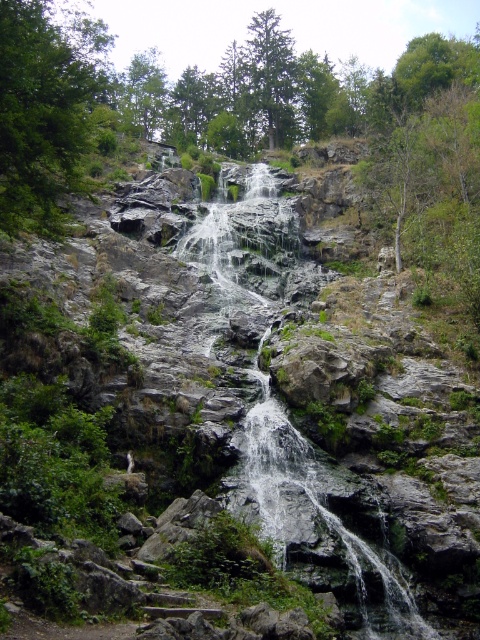
Does green leafy tree at upper left have a greater width compared to green leafy tree at upper center?

Yes, green leafy tree at upper left is wider than green leafy tree at upper center.

Does green leafy tree at upper left have a smaller size compared to green leafy tree at upper center?

Incorrect, green leafy tree at upper left is not smaller in size than green leafy tree at upper center.

Who is more distant from viewer, [31,177] or [148,54]?

The point [148,54] is behind.

At what (x,y) coordinates should I click in order to perform the action: click on green leafy tree at upper left. Please return your answer as a coordinate pair (x, y). This screenshot has height=640, width=480. Looking at the image, I should click on (45, 106).

Who is lower down, green leafy tree at upper left or green matte tree at upper center?

green leafy tree at upper left is below.

In order to click on green leafy tree at upper left in this screenshot , I will do `click(45, 106)`.

Who is higher up, gray stone waterfall at center or green matte tree at upper center?

green matte tree at upper center

Is point (186, 252) positioned after point (269, 58)?

That is False.

Locate an element on the screen. gray stone waterfall at center is located at coordinates (312, 515).